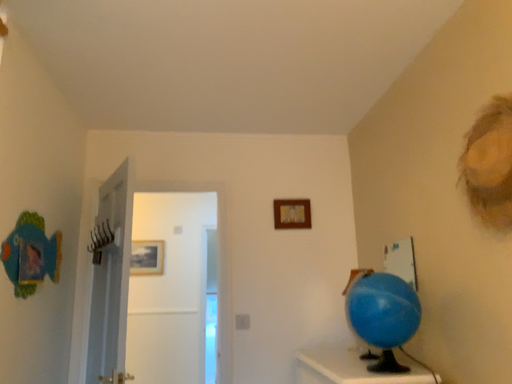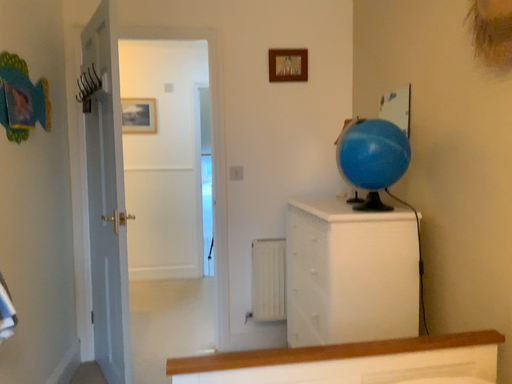
Question: Which way did the camera rotate in the video?

Choices:
 (A) rotated upward
 (B) rotated downward

Answer: (B)